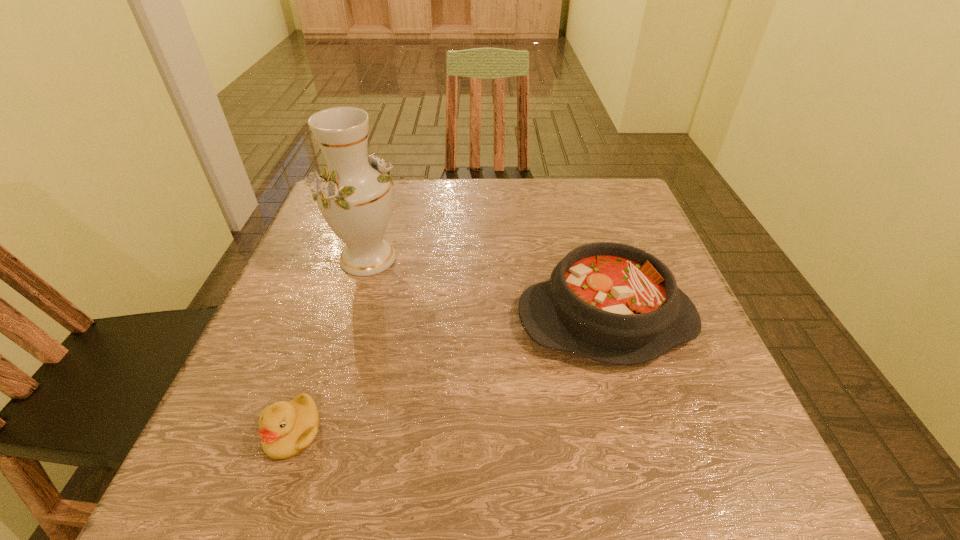
At what (x,y) coordinates should I click in order to perform the action: click on object identified as the closest to the second tallest object. Please return your answer as a coordinate pair (x, y). Image resolution: width=960 pixels, height=540 pixels. Looking at the image, I should click on (355, 198).

Identify the location of object that is the closest to the second shortest object. (355, 198).

Locate an element on the screen. vacant area that satisfies the following two spatial constraints: 1. on the front side of the vase; 2. on the right side of the second shortest object is located at coordinates (349, 320).

Where is `free location that satisfies the following two spatial constraints: 1. on the front side of the tallest object; 2. on the left side of the casserole`? free location that satisfies the following two spatial constraints: 1. on the front side of the tallest object; 2. on the left side of the casserole is located at coordinates [349, 320].